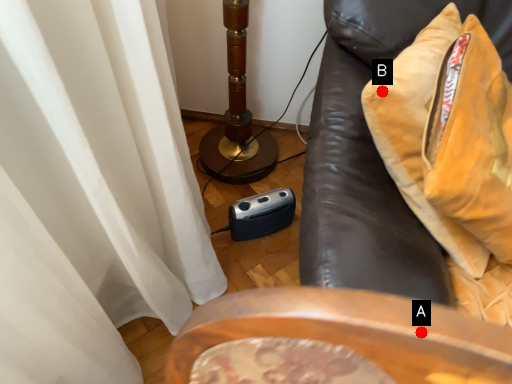
Question: Two points are circled on the image, labeled by A and B beside each circle. Which point is closer to the camera taking this photo?

Choices:
 (A) A is closer
 (B) B is closer

Answer: (A)